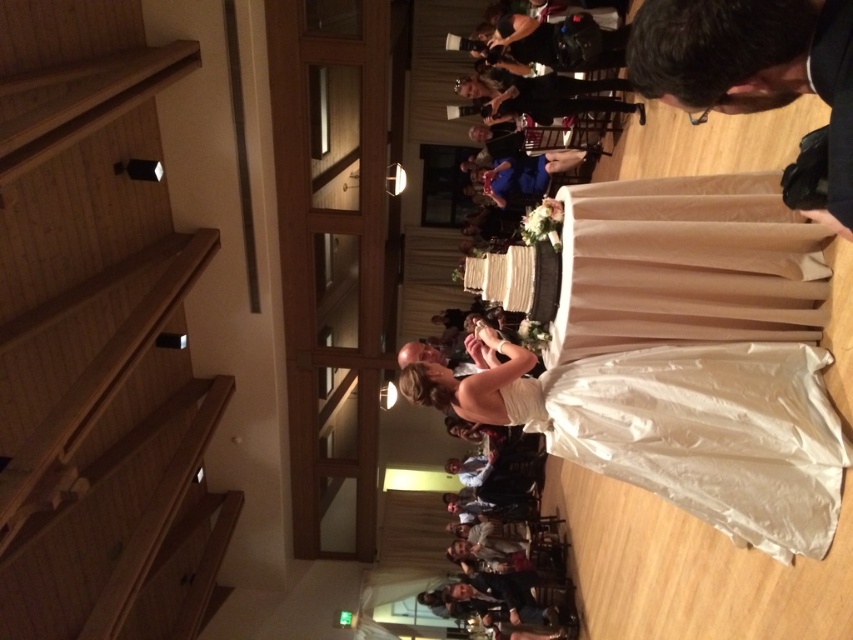
You are a photographer at the wedding reception. You want to take a photo of the white satin dress at center without the black leather camera at upper right appearing in the frame. Is this possible given their positions?

The white satin dress at center is closer to you than the black leather camera at upper right, so you can position yourself to capture the dress while avoiding the camera in the background.

You are a photographer at the wedding reception. You need to position yourself so that both the point at coordinate (68, 221) and the point at coordinate (693, 577) are visible in your shot. Given their depth positions, which point will appear closer to the camera in the final photo?

Point at coordinate (68, 221) will appear closer to the camera in the final photo because it is further to the camera than point at coordinate (693, 577) according to the description.